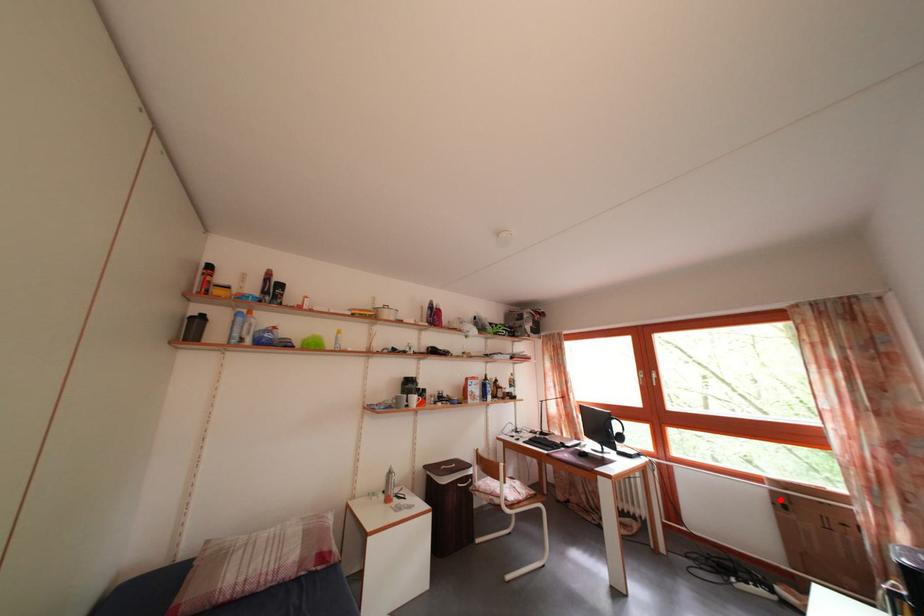
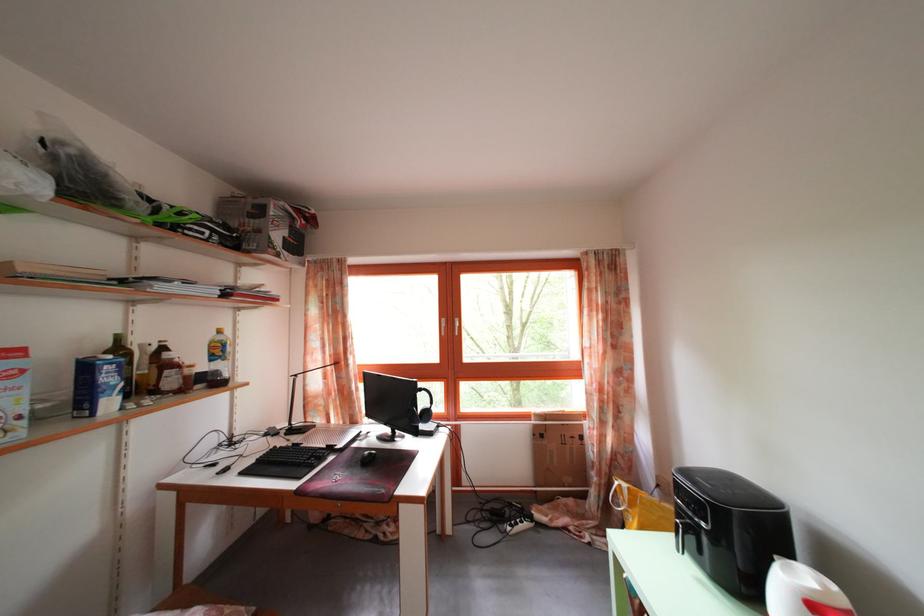
Question: I am providing you with two images of the same scene from different viewpoints. Given a red point in image1, look at the same physical point in image2. Is it:

Choices:
 (A) Closer to the viewpoint
 (B) Farther from the viewpoint

Answer: (B)